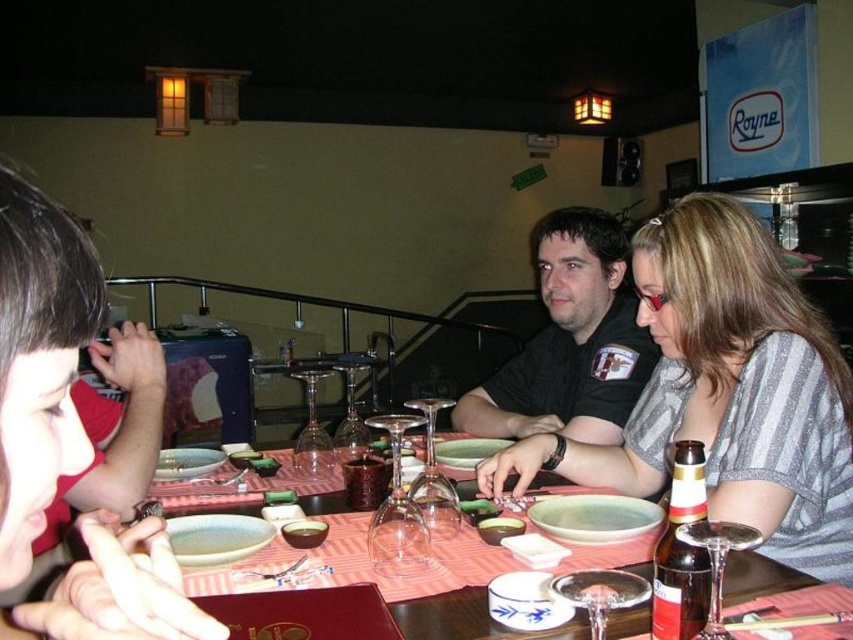
Between brown glass bottle at right and smooth porcelain bowl at center, which one is positioned lower?

smooth porcelain bowl at center is below.

Measure the distance between brown glass bottle at right and camera.

26.58 inches

At what (x,y) coordinates should I click in order to perform the action: click on brown glass bottle at right. Please return your answer as a coordinate pair (x, y). Looking at the image, I should click on (682, 550).

Does matte ceramic bowl at center have a lesser height compared to smooth porcelain bowl at center?

No, matte ceramic bowl at center is not shorter than smooth porcelain bowl at center.

The width and height of the screenshot is (853, 640). I want to click on matte ceramic bowl at center, so click(x=398, y=579).

Which is above, striped fabric shirt at center or brown glass bottle at right?

striped fabric shirt at center is higher up.

Identify the location of striped fabric shirt at center. Image resolution: width=853 pixels, height=640 pixels. (726, 392).